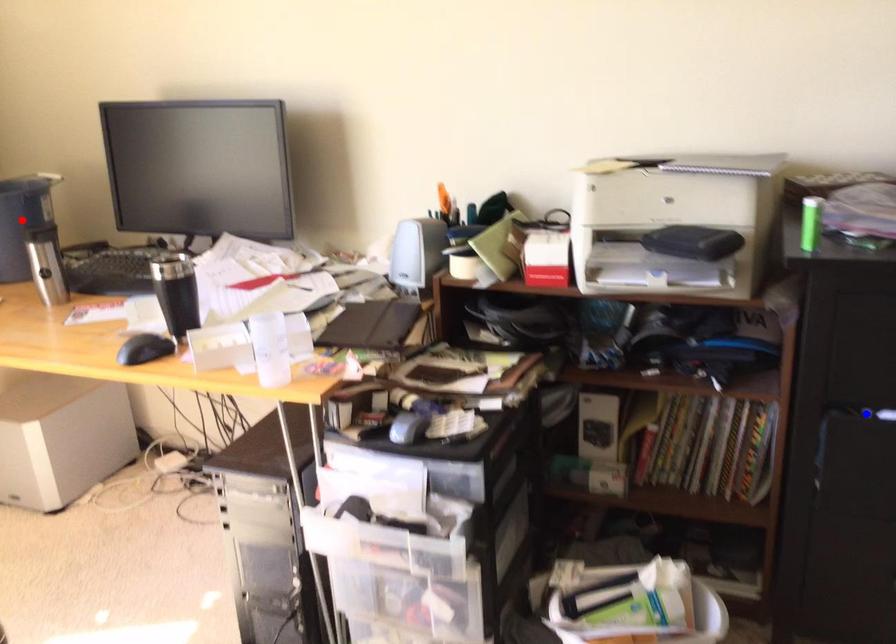
Question: In the image, two points are highlighted. Which point is nearer to the camera? Reply with the corresponding letter.

Choices:
 (A) blue point
 (B) red point

Answer: (A)